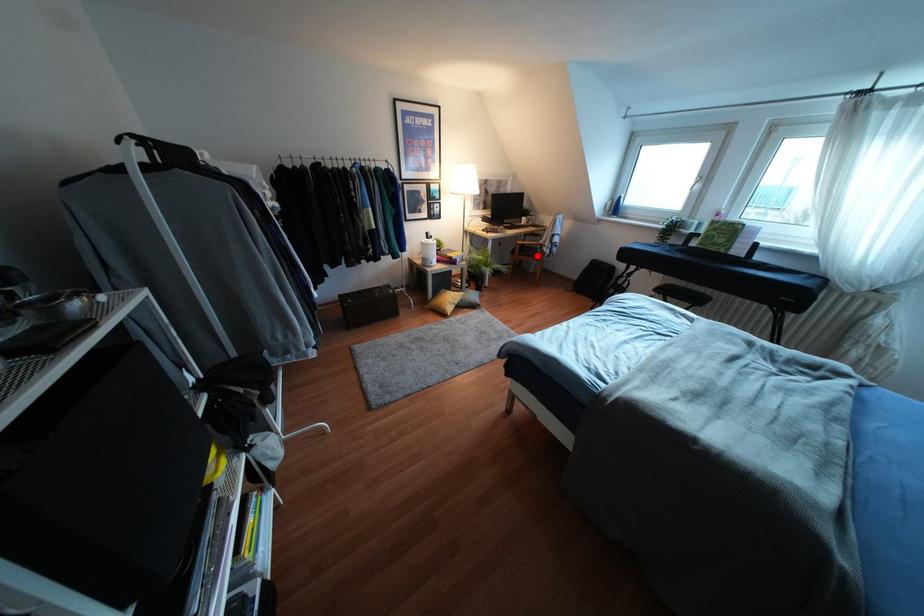
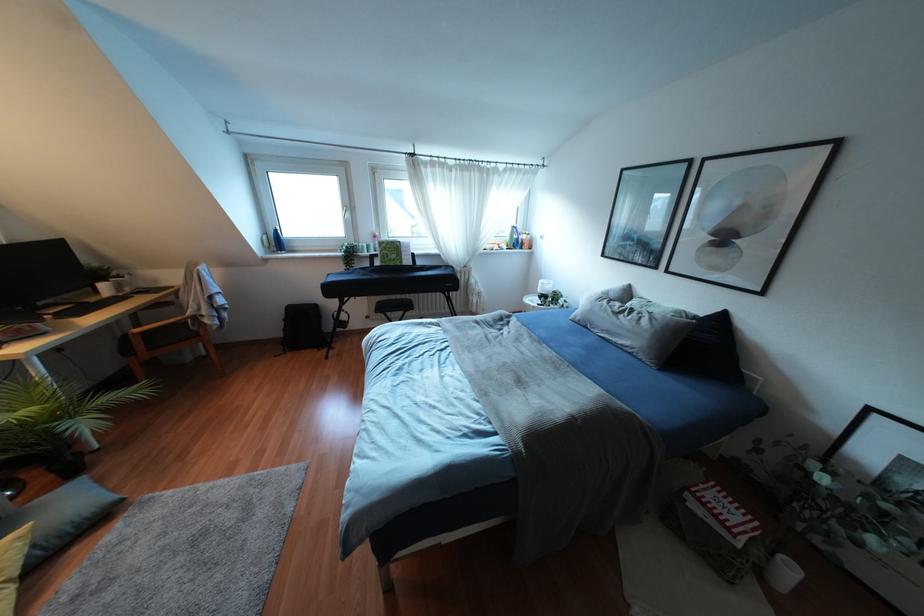
In the second image, find the point that corresponds to the highlighted location in the first image.

(196, 334)